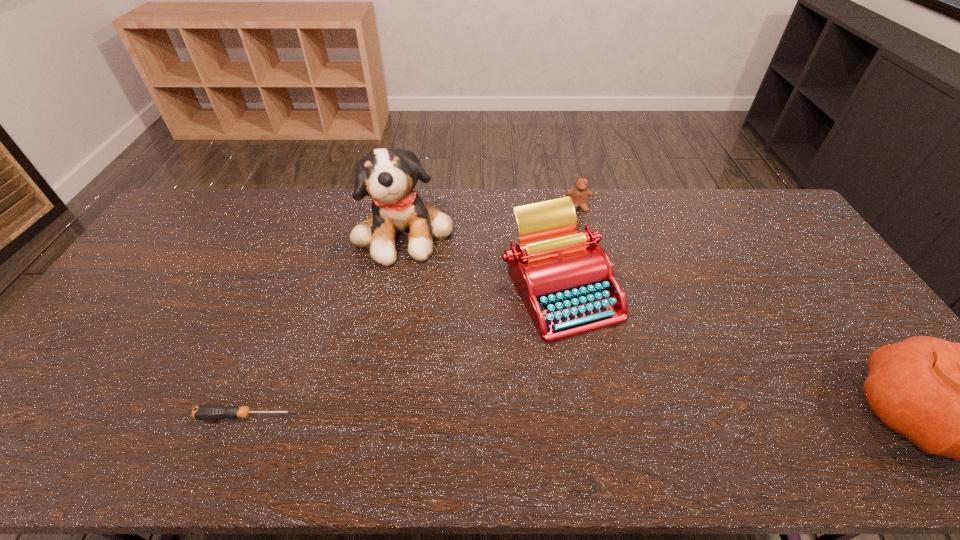
Locate an element on the screen. free space on the desktop that is between the shortest object and the rightmost object and is positioned on the face of the fourth tallest object is located at coordinates (604, 416).

The height and width of the screenshot is (540, 960). What are the coordinates of `vacant spot on the desktop that is between the screwdriver and the rightmost object and is positioned on the typing side of the third tallest object` in the screenshot? It's located at (548, 416).

Locate an element on the screen. This screenshot has width=960, height=540. vacant space on the desktop that is between the shortest object and the fourth shortest object and is positioned at the face of the puppy is located at coordinates (496, 416).